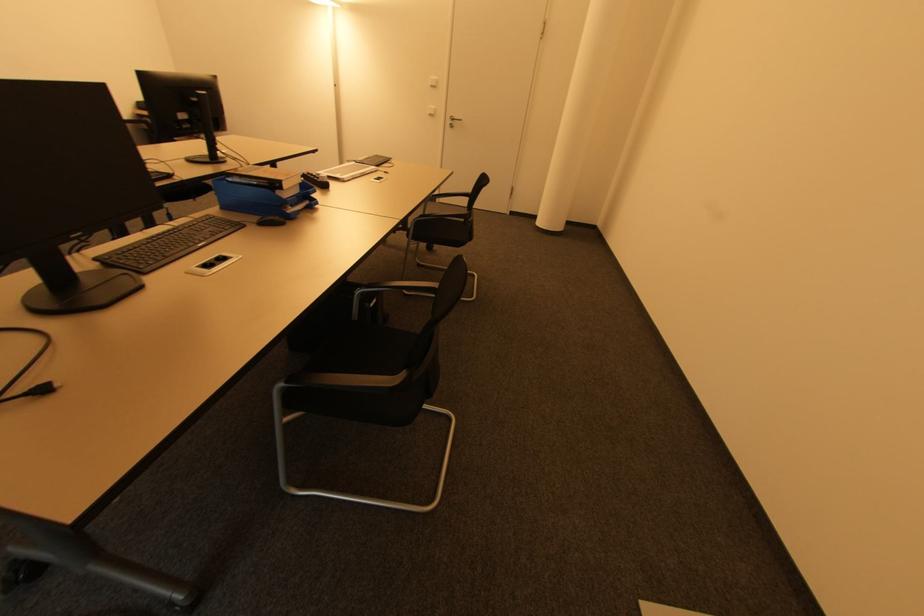
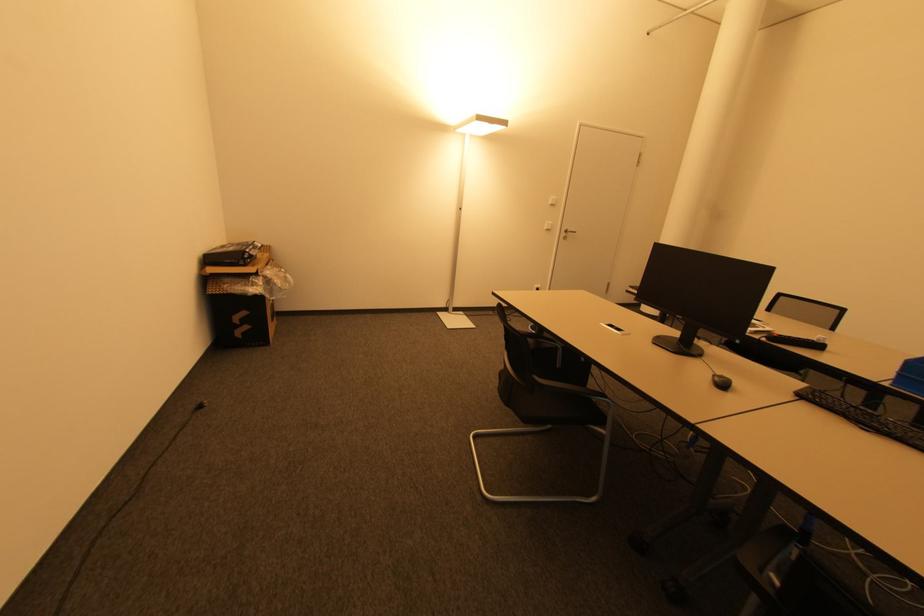
The point at (x=451, y=123) is marked in the first image. Where is the corresponding point in the second image?

(565, 235)